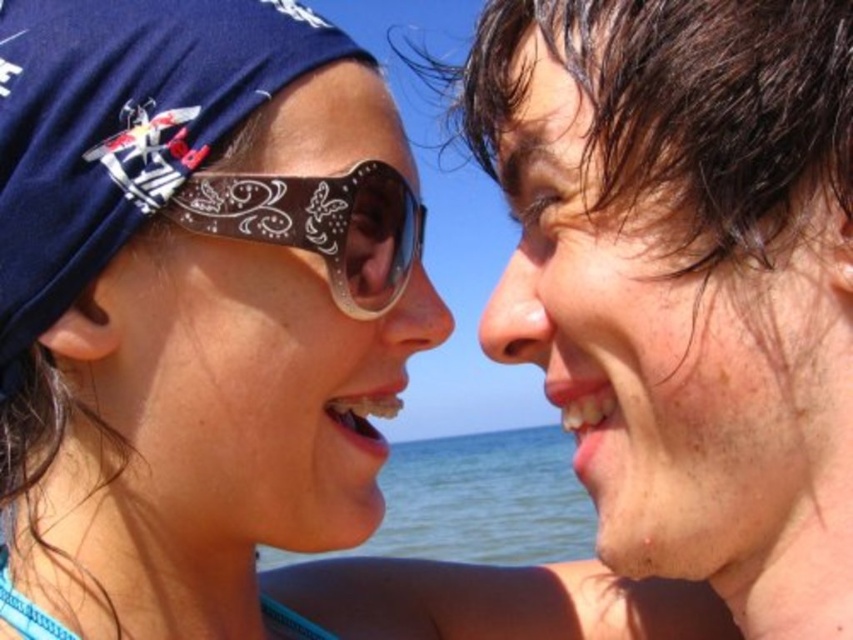
Which of these two, blue water at center or brown leather goggles at center, stands shorter?

brown leather goggles at center is shorter.

What do you see at coordinates (485, 499) in the screenshot? The height and width of the screenshot is (640, 853). I see `blue water at center` at bounding box center [485, 499].

Measure the distance between point (512, 442) and camera.

A distance of 55.80 meters exists between point (512, 442) and camera.

Locate an element on the screen. This screenshot has height=640, width=853. blue water at center is located at coordinates (485, 499).

Based on the photo, can you confirm if dry skin face at right is taller than matte black sunglasses at left?

No, dry skin face at right is not taller than matte black sunglasses at left.

Can you confirm if dry skin face at right is smaller than matte black sunglasses at left?

Incorrect, dry skin face at right is not smaller in size than matte black sunglasses at left.

Which is behind, point (751, 465) or point (252, 342)?

Point (252, 342)

This screenshot has height=640, width=853. In order to click on dry skin face at right in this screenshot , I will do `click(660, 337)`.

Which is more to the left, dry skin face at right or brown leather goggles at center?

brown leather goggles at center is more to the left.

Identify the location of dry skin face at right. (660, 337).